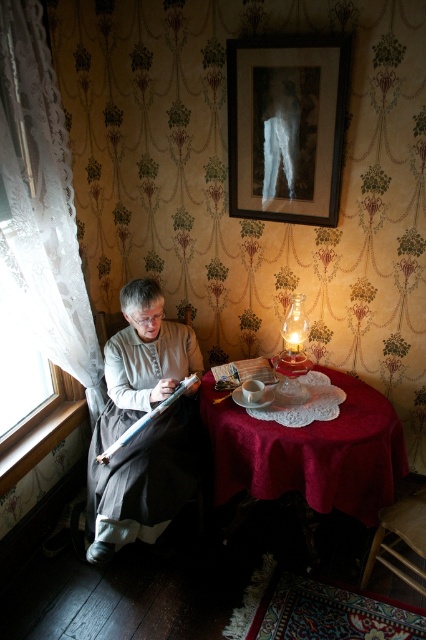
Question: Which point appears farthest from the camera in this image?

Choices:
 (A) (316, 506)
 (B) (43, 266)
 (C) (106, 493)
 (D) (301, 211)

Answer: (D)

Question: Can you confirm if wooden framed print at upper center is smaller than gray woolen robe at left?

Choices:
 (A) yes
 (B) no

Answer: (A)

Question: Can you confirm if white lace curtain at left is positioned below gray woolen robe at left?

Choices:
 (A) yes
 (B) no

Answer: (B)

Question: Based on their relative distances, which object is nearer to the gray woolen robe at left?

Choices:
 (A) velvet red tablecloth at center
 (B) wooden framed print at upper center
 (C) white lace curtain at left

Answer: (A)

Question: Among these objects, which one is nearest to the camera?

Choices:
 (A) gray woolen robe at left
 (B) wooden framed print at upper center

Answer: (A)

Question: Considering the relative positions of white lace curtain at left and wooden framed print at upper center in the image provided, where is white lace curtain at left located with respect to wooden framed print at upper center?

Choices:
 (A) left
 (B) right

Answer: (A)